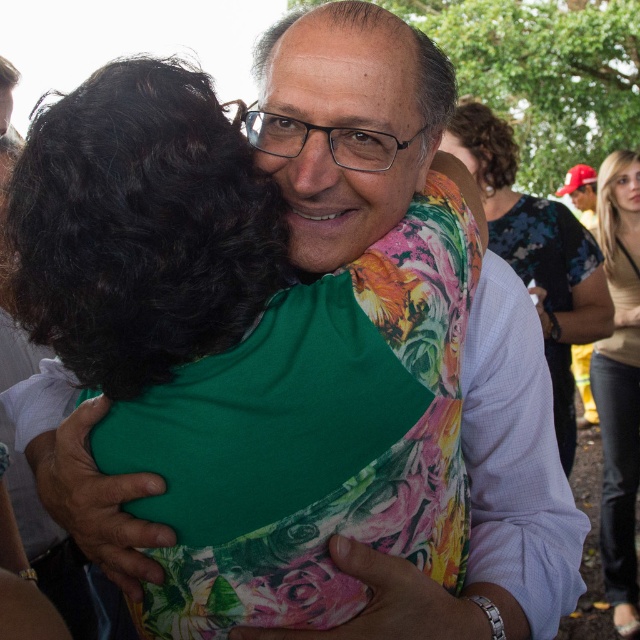
Question: Which object is farther from the camera taking this photo?

Choices:
 (A) floral fabric dress at center
 (B) light brown leather jacket at right

Answer: (B)

Question: Does floral fabric dress at center have a lesser width compared to light brown leather jacket at right?

Choices:
 (A) no
 (B) yes

Answer: (A)

Question: Observing the image, what is the correct spatial positioning of floral fabric dress at center in reference to light brown leather jacket at right?

Choices:
 (A) above
 (B) below

Answer: (A)

Question: Does floral fabric dress at center appear over light brown leather jacket at right?

Choices:
 (A) yes
 (B) no

Answer: (A)

Question: Which object appears closest to the camera in this image?

Choices:
 (A) light brown leather jacket at right
 (B) floral fabric dress at center

Answer: (B)

Question: Which point is farther to the camera?

Choices:
 (A) (621, 576)
 (B) (600, 328)

Answer: (A)